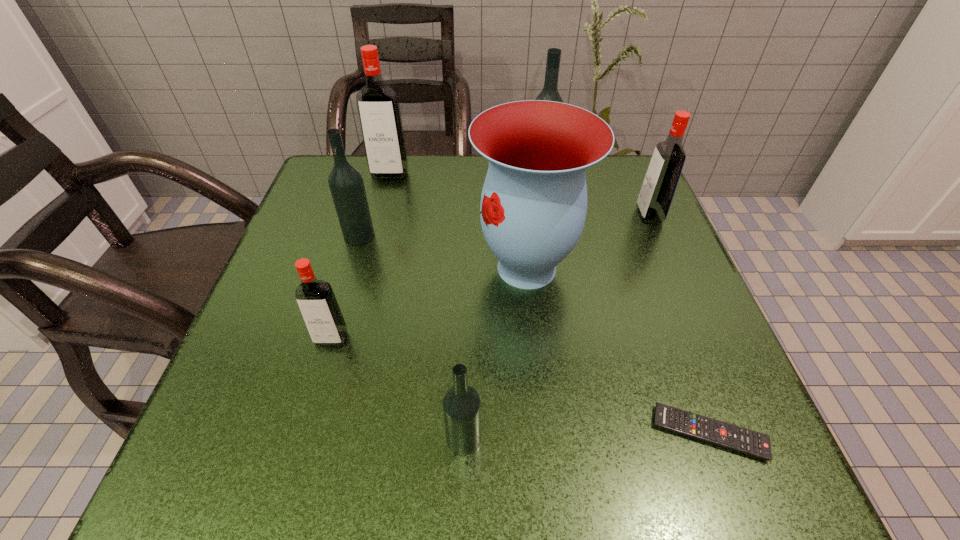
You are a GUI agent. You are given a task and a screenshot of the screen. Output one action in this format:
    pyautogui.click(x=<x>, y=<y>)
    Task: Click on the biggest black vodka
    Image resolution: width=960 pixels, height=540 pixels.
    Given the screenshot: What is the action you would take?
    pyautogui.click(x=549, y=92)

You are a GUI agent. You are given a task and a screenshot of the screen. Output one action in this format:
    pyautogui.click(x=<x>, y=<y>)
    Task: Click on the farthest black vodka
    The image size is (960, 540).
    Given the screenshot: What is the action you would take?
    pyautogui.click(x=549, y=92)

Find the location of a particular element. This screenshot has width=960, height=540. the farthest red vodka is located at coordinates (378, 107).

Locate an element on the screen. This screenshot has height=540, width=960. vase is located at coordinates (533, 206).

Identify the location of the second nearest red vodka. This screenshot has height=540, width=960. (660, 182).

Locate an element on the screen. the second smallest red vodka is located at coordinates 660,182.

At what (x,y) coordinates should I click in order to perform the action: click on the second biggest black vodka. Please return your answer as a coordinate pair (x, y). The width and height of the screenshot is (960, 540). Looking at the image, I should click on (346, 184).

You are a GUI agent. You are given a task and a screenshot of the screen. Output one action in this format:
    pyautogui.click(x=<x>, y=<y>)
    Task: Click on the second farthest black vodka
    Image resolution: width=960 pixels, height=540 pixels.
    Given the screenshot: What is the action you would take?
    pyautogui.click(x=346, y=184)

Image resolution: width=960 pixels, height=540 pixels. I want to click on the smallest red vodka, so click(316, 300).

Image resolution: width=960 pixels, height=540 pixels. I want to click on the second nearest vodka, so click(x=316, y=300).